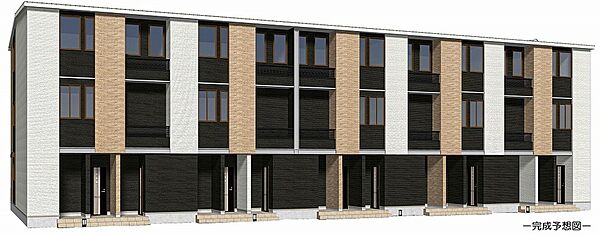
Identify the location of trim. (60, 5), (556, 45).